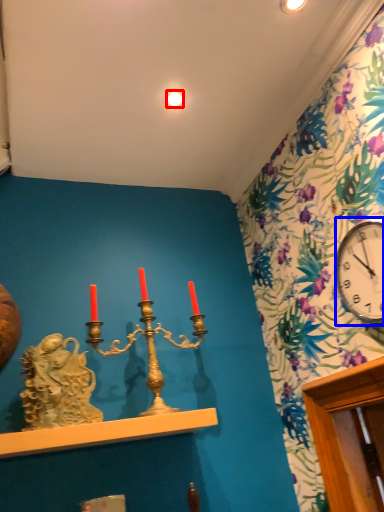
Question: Which of the following is the closest to the observer, light (highlighted by a red box) or clock (highlighted by a blue box)?

Choices:
 (A) light
 (B) clock

Answer: (B)